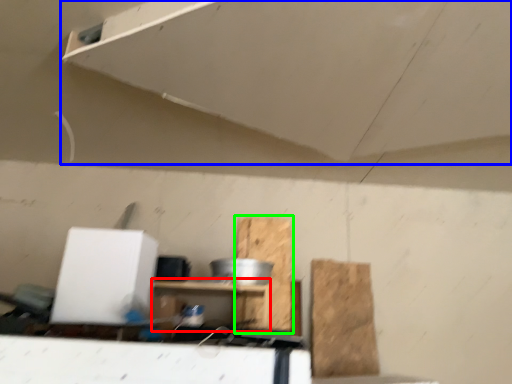
Question: Which is nearer to the furniture (highlighted by a red box)? exhaust hood (highlighted by a blue box) or cardboard (highlighted by a green box).

Choices:
 (A) exhaust hood
 (B) cardboard

Answer: (B)